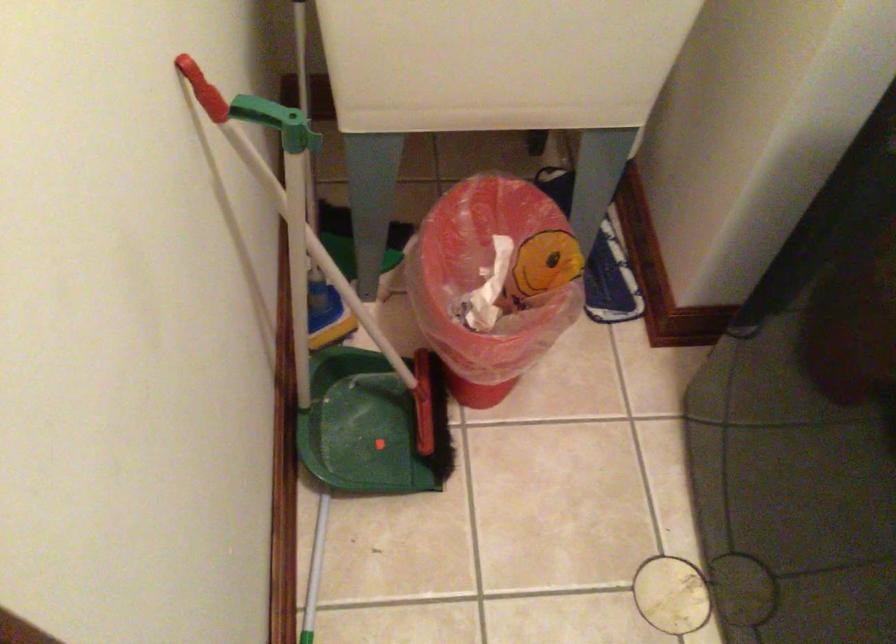
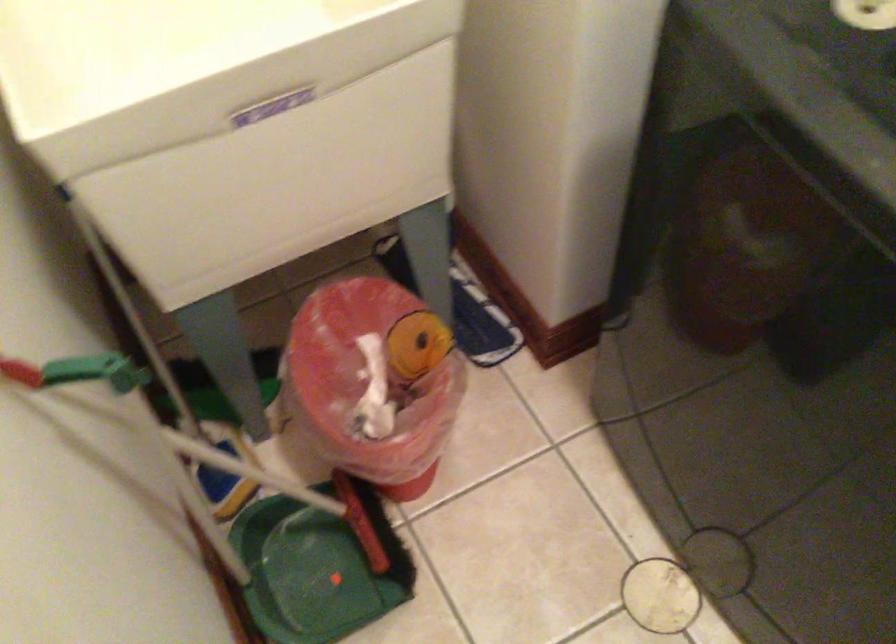
Where in the second image is the point corresponding to [334,283] from the first image?

(228, 462)